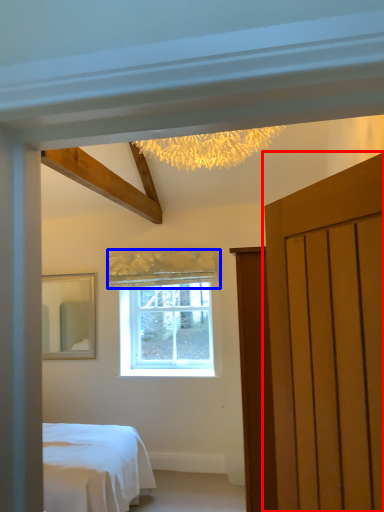
Question: Which object appears farthest to the camera in this image, door (highlighted by a red box) or curtain (highlighted by a blue box)?

Choices:
 (A) door
 (B) curtain

Answer: (B)